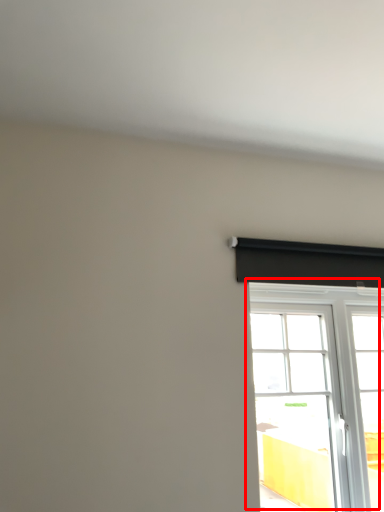
Question: From the image's perspective, where is window (annotated by the red box) located relative to curtain?

Choices:
 (A) above
 (B) below

Answer: (B)